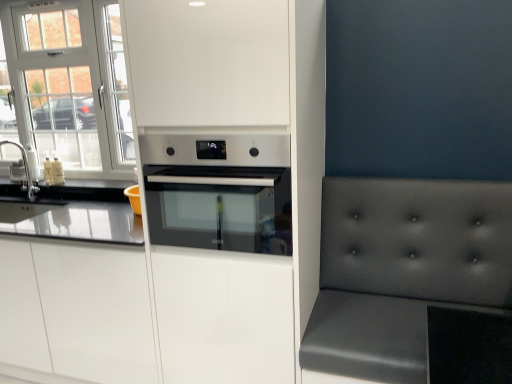
Question: Is brushed metal sink at left far from white glass window at upper left?

Choices:
 (A) yes
 (B) no

Answer: (B)

Question: From a real-world perspective, is brushed metal sink at left physically below white glass window at upper left?

Choices:
 (A) no
 (B) yes

Answer: (B)

Question: From a real-world perspective, is brushed metal sink at left over white glass window at upper left?

Choices:
 (A) no
 (B) yes

Answer: (A)

Question: From the image's perspective, is brushed metal sink at left on top of white glass window at upper left?

Choices:
 (A) no
 (B) yes

Answer: (A)

Question: Does brushed metal sink at left appear on the right side of white glass window at upper left?

Choices:
 (A) no
 (B) yes

Answer: (A)

Question: Is brushed metal sink at left positioned with its back to white glass window at upper left?

Choices:
 (A) yes
 (B) no

Answer: (A)

Question: Considering the relative sizes of brushed metal sink at left and white matte cabinet at center, which is the 1th cabinetry from left to right, in the image provided, is brushed metal sink at left thinner than white matte cabinet at center, which is the 1th cabinetry from left to right,?

Choices:
 (A) yes
 (B) no

Answer: (A)

Question: From the image's perspective, is brushed metal sink at left located beneath white matte cabinet at center, which is the 1th cabinetry from left to right?

Choices:
 (A) no
 (B) yes

Answer: (A)

Question: Considering the relative sizes of brushed metal sink at left and white matte cabinet at center, which ranks as the second cabinetry in right-to-left order, in the image provided, is brushed metal sink at left shorter than white matte cabinet at center, which ranks as the second cabinetry in right-to-left order,?

Choices:
 (A) no
 (B) yes

Answer: (B)

Question: From the image's perspective, is brushed metal sink at left on white matte cabinet at center, which ranks as the second cabinetry in right-to-left order?

Choices:
 (A) yes
 (B) no

Answer: (A)

Question: Is brushed metal sink at left looking in the opposite direction of white matte cabinet at center, which ranks as the second cabinetry in right-to-left order?

Choices:
 (A) yes
 (B) no

Answer: (B)

Question: Does brushed metal sink at left come in front of white matte cabinet at center, which ranks as the second cabinetry in right-to-left order?

Choices:
 (A) yes
 (B) no

Answer: (B)

Question: Considering the relative sizes of matte gray cushion at right and white matte cabinet at center, which is the 1th cabinetry from left to right, in the image provided, is matte gray cushion at right shorter than white matte cabinet at center, which is the 1th cabinetry from left to right,?

Choices:
 (A) yes
 (B) no

Answer: (B)